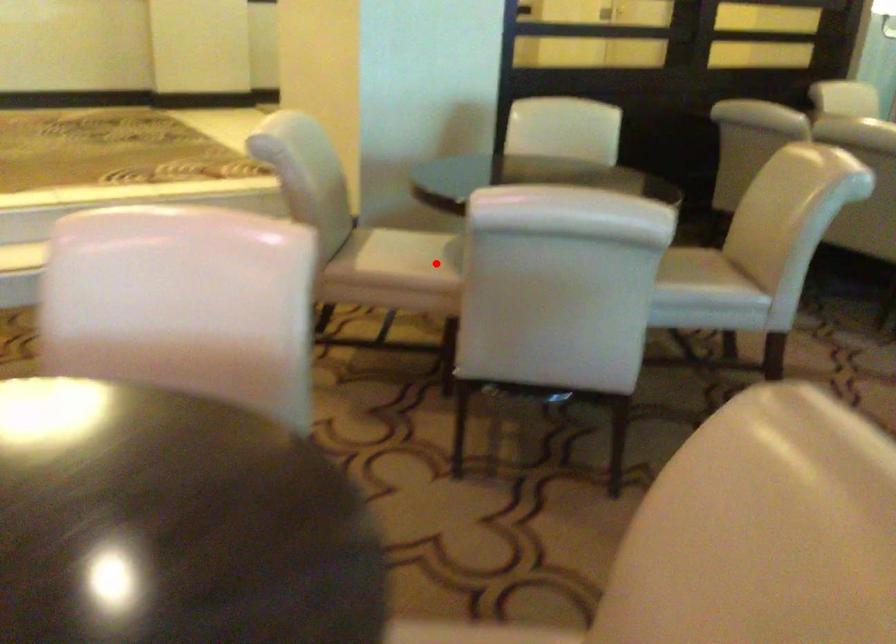
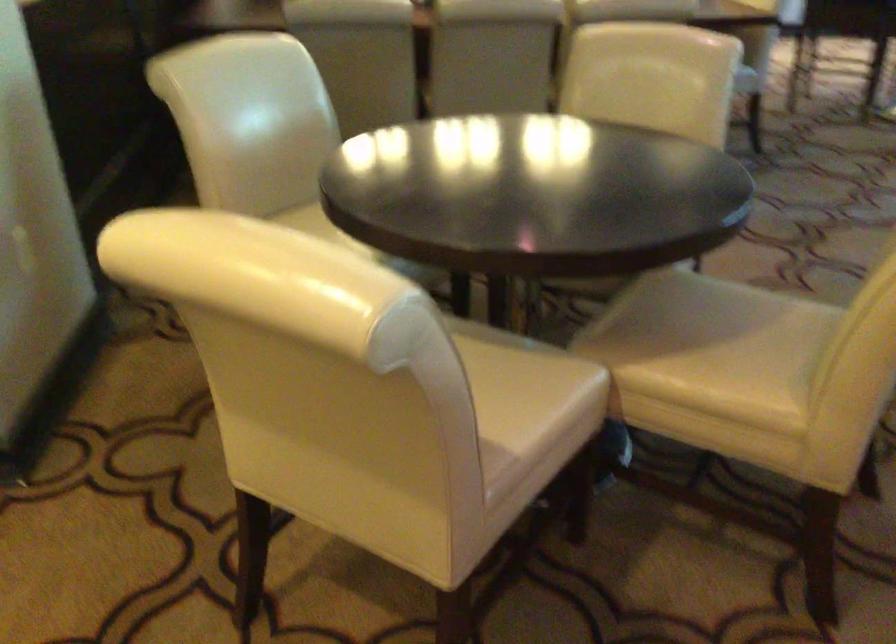
Question: A red point is marked in image1. In image2, is the corresponding 3D point closer to the camera or farther? Reply with the corresponding letter.

Choices:
 (A) The corresponding 3D point is closer.
 (B) The corresponding 3D point is farther.

Answer: (A)